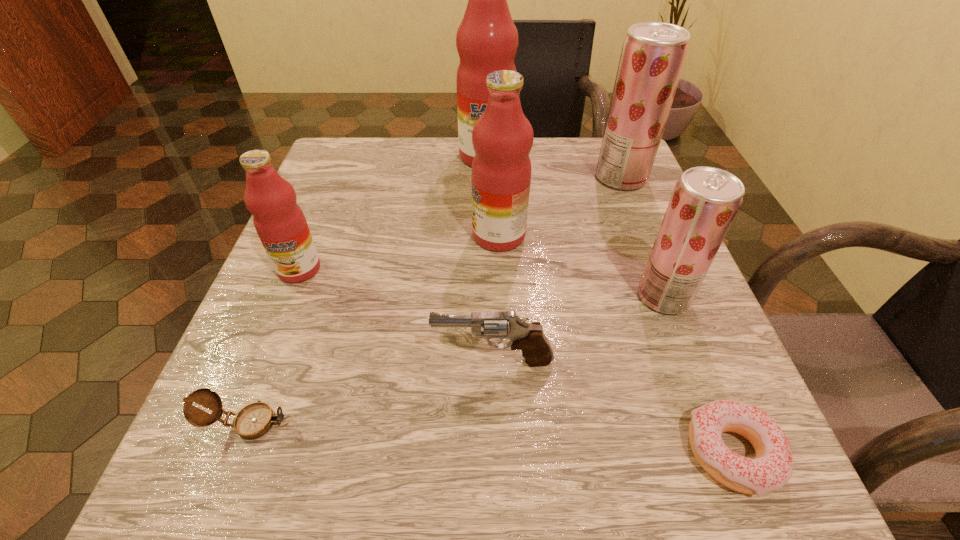
The width and height of the screenshot is (960, 540). I want to click on vacant position in the image that satisfies the following two spatial constraints: 1. on the label of the third nearest fruit juice; 2. on the right side of the nearer strawberry fruit juice, so tap(502, 296).

Identify the location of vacant region that satisfies the following two spatial constraints: 1. on the front side of the shortest object; 2. on the right side of the nearer strawberry fruit juice. (724, 454).

The height and width of the screenshot is (540, 960). Identify the location of blank space that satisfies the following two spatial constraints: 1. at the barrel of the third nearest object; 2. on the left side of the shortest object. (495, 454).